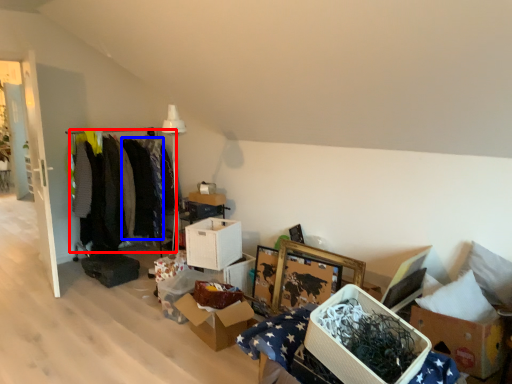
Question: Which object is further to the camera taking this photo, clothing (highlighted by a red box) or clothing (highlighted by a blue box)?

Choices:
 (A) clothing
 (B) clothing

Answer: (B)